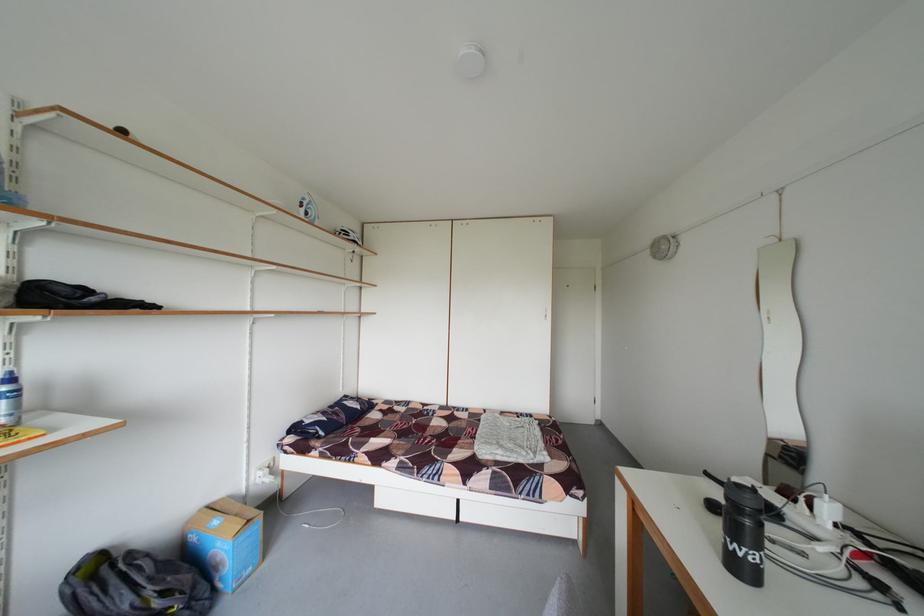
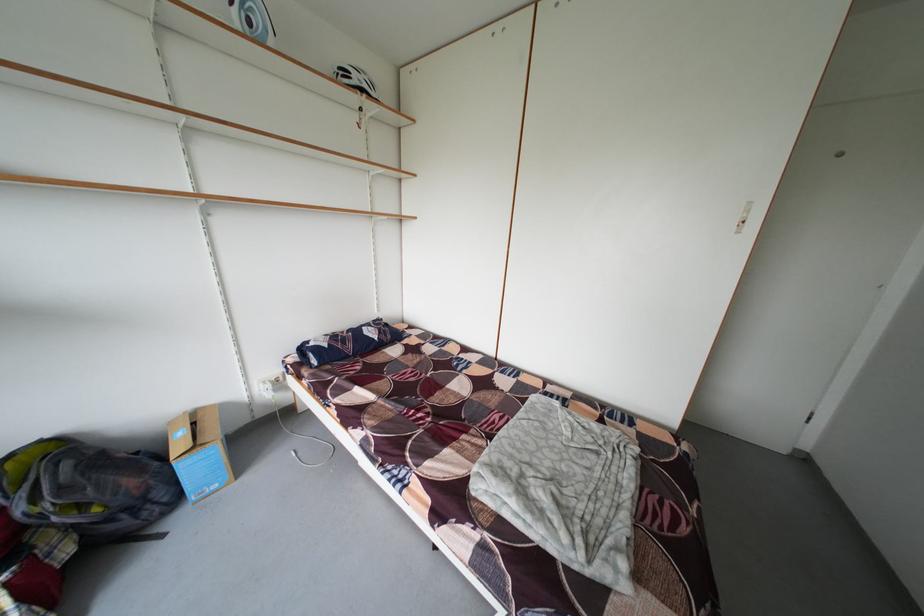
In the second image, find the point that corresponds to (263,476) in the first image.

(265, 387)